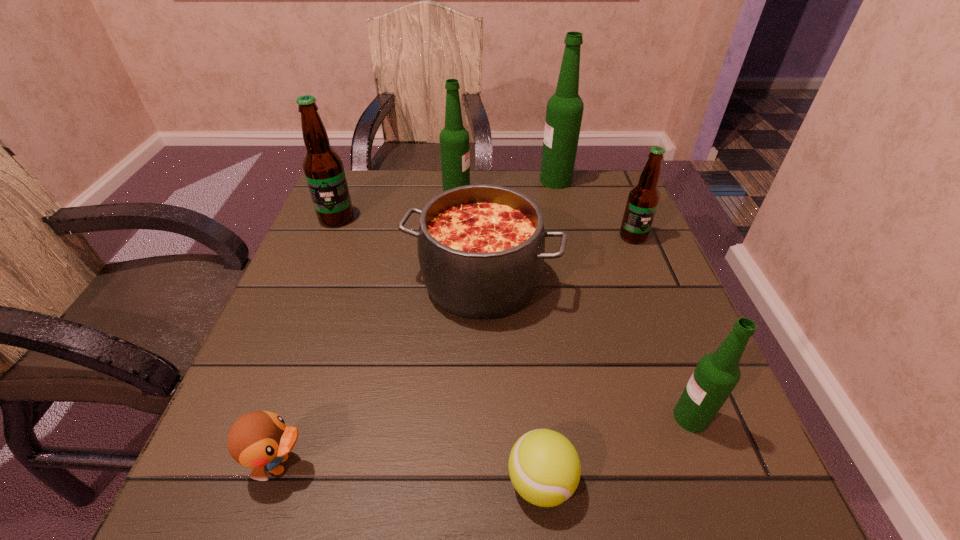
I want to click on duck that is at the left edge, so click(x=260, y=440).

You are a GUI agent. You are given a task and a screenshot of the screen. Output one action in this format:
    pyautogui.click(x=<x>, y=<y>)
    Task: Click on the object at the far left corner
    
    Given the screenshot: What is the action you would take?
    pyautogui.click(x=323, y=168)

Locate an element on the screen. The width and height of the screenshot is (960, 540). object present at the near left corner is located at coordinates (260, 440).

Locate an element on the screen. object that is at the far right corner is located at coordinates (564, 111).

Where is `free space at the far edge of the desktop`? Image resolution: width=960 pixels, height=540 pixels. free space at the far edge of the desktop is located at coordinates (515, 174).

The image size is (960, 540). In order to click on vacant point at the near edge in this screenshot , I will do `click(492, 519)`.

Find the location of `vacant area at the left edge of the desktop`. vacant area at the left edge of the desktop is located at coordinates (332, 232).

Find the location of a particular element. The height and width of the screenshot is (540, 960). vacant space at the right edge of the desktop is located at coordinates (664, 381).

Where is `free space at the far left corner`? The width and height of the screenshot is (960, 540). free space at the far left corner is located at coordinates (360, 194).

Image resolution: width=960 pixels, height=540 pixels. In order to click on vacant area that lies between the right brown beer bottle and the green tennis ball in this screenshot , I will do `click(587, 359)`.